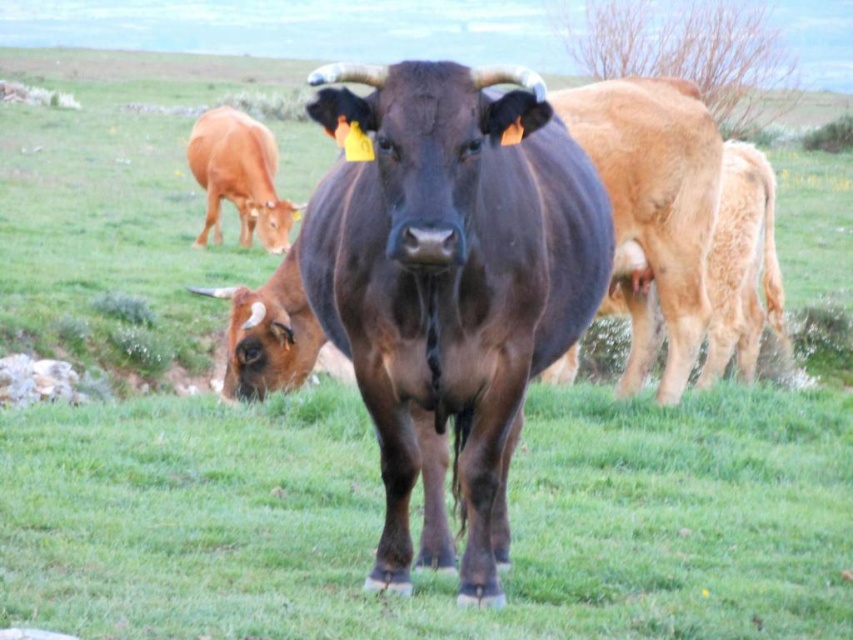
Can you confirm if brown glossy cow at lower left is positioned above brown glossy cow at left?

No, brown glossy cow at lower left is not above brown glossy cow at left.

Between brown glossy cow at lower left and brown glossy cow at left, which one is positioned higher?

brown glossy cow at left is higher up.

The width and height of the screenshot is (853, 640). I want to click on brown glossy cow at lower left, so click(x=268, y=333).

Looking at this image, is shiny brown bull at center further to the viewer compared to brown glossy cow at left?

No.

Who is more distant from viewer, (x=556, y=225) or (x=270, y=132)?

Point (x=270, y=132)

Identify the location of shiny brown bull at center. The width and height of the screenshot is (853, 640). (451, 276).

Who is more forward, (576, 285) or (265, 378)?

Point (576, 285) is in front.

How far apart are shiny brown bull at center and brown glossy cow at lower left?

shiny brown bull at center and brown glossy cow at lower left are 4.23 meters apart.

The height and width of the screenshot is (640, 853). I want to click on shiny brown bull at center, so click(451, 276).